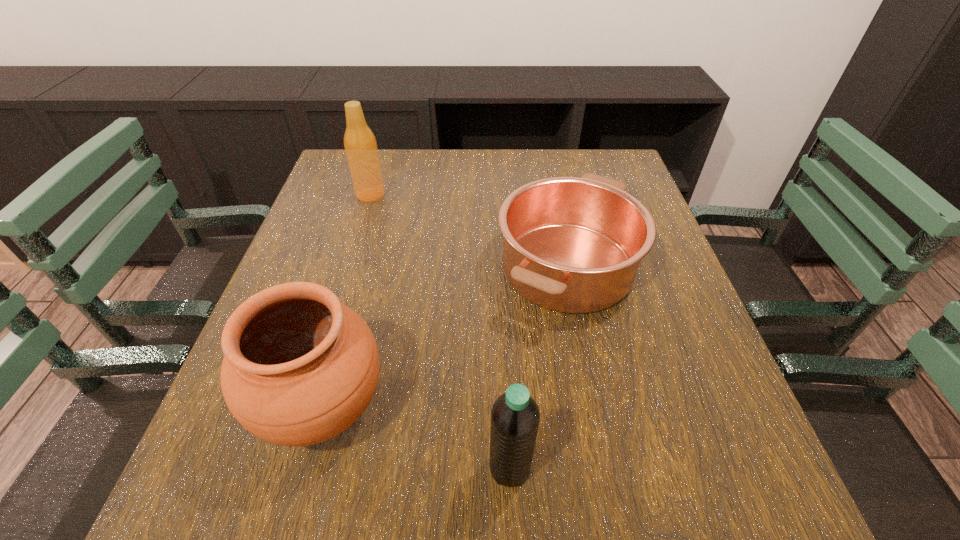
Where is `vacant area at the right edge of the desktop`? This screenshot has width=960, height=540. vacant area at the right edge of the desktop is located at coordinates (719, 451).

Where is `free space at the far left corner of the desktop`? The width and height of the screenshot is (960, 540). free space at the far left corner of the desktop is located at coordinates (381, 167).

Find the location of a particular element. The width and height of the screenshot is (960, 540). vacant area at the far right corner of the desktop is located at coordinates (570, 156).

I want to click on vacant space in between the farthest object and the saucepan, so click(468, 230).

You are a GUI agent. You are given a task and a screenshot of the screen. Output one action in this format:
    pyautogui.click(x=<x>, y=<y>)
    Task: Click on the vacant space that's between the beer bottle and the water bottle
    This screenshot has height=540, width=960.
    Given the screenshot: What is the action you would take?
    pyautogui.click(x=440, y=331)

The width and height of the screenshot is (960, 540). Identify the location of vacant point located between the water bottle and the pottery. (417, 437).

This screenshot has height=540, width=960. Identify the location of free space between the pottery and the water bottle. (417, 437).

Where is `free space between the farthest object and the saucepan`? free space between the farthest object and the saucepan is located at coordinates (468, 230).

This screenshot has width=960, height=540. I want to click on empty space between the water bottle and the pottery, so click(417, 437).

Where is `free spot between the beer bottle and the pottery`? This screenshot has width=960, height=540. free spot between the beer bottle and the pottery is located at coordinates (348, 301).